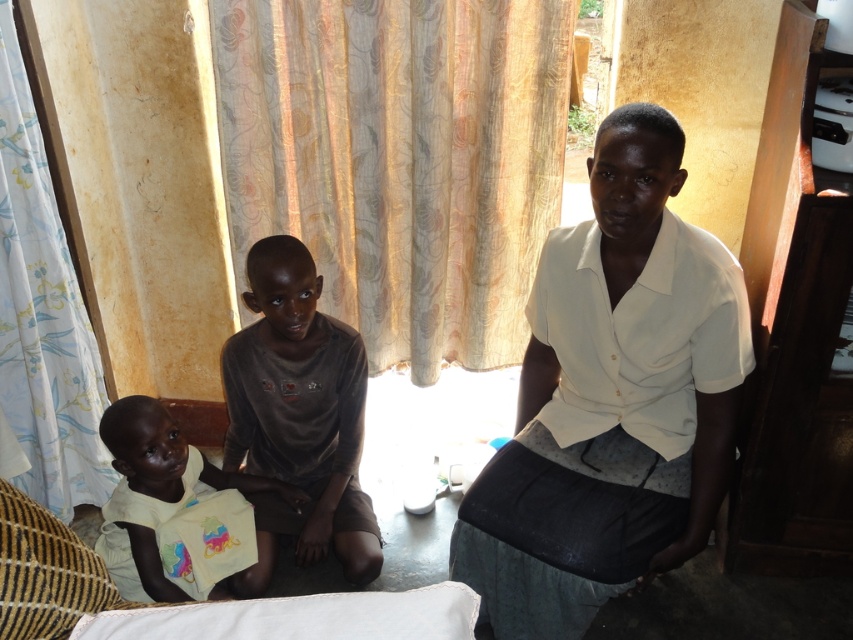
Does brown cotton shirt at center have a larger size compared to white floral fabric curtain at left?

Yes, brown cotton shirt at center is bigger than white floral fabric curtain at left.

Can you confirm if brown cotton shirt at center is smaller than white floral fabric curtain at left?

No.

Describe the element at coordinates (299, 417) in the screenshot. I see `brown cotton shirt at center` at that location.

Locate an element on the screen. brown cotton shirt at center is located at coordinates (299, 417).

Who is taller, light beige sheer curtain at center or white floral fabric curtain at left?

With more height is white floral fabric curtain at left.

Between light beige sheer curtain at center and white floral fabric curtain at left, which one is positioned higher?

light beige sheer curtain at center is above.

Where is `light beige sheer curtain at center`? This screenshot has height=640, width=853. light beige sheer curtain at center is located at coordinates (399, 157).

Does light beige sheer curtain at center have a larger size compared to white matte shirt at center?

Yes.

Can you confirm if light beige sheer curtain at center is smaller than white matte shirt at center?

Actually, light beige sheer curtain at center might be larger than white matte shirt at center.

Is point (448, 200) behind point (573, 404)?

Yes, it is.

Where is `light beige sheer curtain at center`? light beige sheer curtain at center is located at coordinates (399, 157).